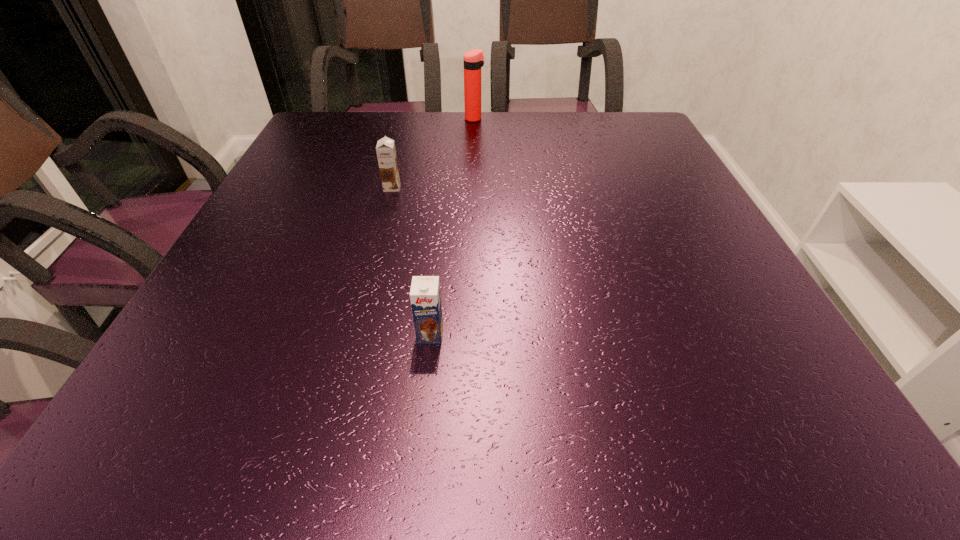
Where is `free space between the second object from left to right and the tallest object`? free space between the second object from left to right and the tallest object is located at coordinates (452, 226).

This screenshot has height=540, width=960. I want to click on vacant area that lies between the leftmost object and the second object from right to left, so click(x=411, y=261).

At what (x,y) coordinates should I click in order to perform the action: click on free space between the nearest object and the thermos bottle. Please return your answer as a coordinate pair (x, y). This screenshot has height=540, width=960. Looking at the image, I should click on (452, 226).

Locate an element on the screen. unoccupied position between the left chocolate milk and the farthest object is located at coordinates (433, 153).

You are a GUI agent. You are given a task and a screenshot of the screen. Output one action in this format:
    pyautogui.click(x=<x>, y=<y>)
    Task: Click on the unoccupied area between the second nearest object and the right chocolate milk
    
    Given the screenshot: What is the action you would take?
    pyautogui.click(x=411, y=261)

The image size is (960, 540). Find the location of `vacant point located between the leftmost object and the nearer chocolate milk`. vacant point located between the leftmost object and the nearer chocolate milk is located at coordinates (411, 261).

What are the coordinates of `object that stands as the closest to the leftmost object` in the screenshot? It's located at (473, 60).

Select which object is the second closest to the tallest object. Please provide its 2D coordinates. Your answer should be formatted as a tuple, i.e. [(x, y)], where the tuple contains the x and y coordinates of a point satisfying the conditions above.

[(425, 297)]

You are a GUI agent. You are given a task and a screenshot of the screen. Output one action in this format:
    pyautogui.click(x=<x>, y=<y>)
    Task: Click on the free space in the image that satisfies the following two spatial constraints: 1. on the back side of the farthest object; 2. on the right side of the second farthest object
    
    Given the screenshot: What is the action you would take?
    pyautogui.click(x=410, y=119)